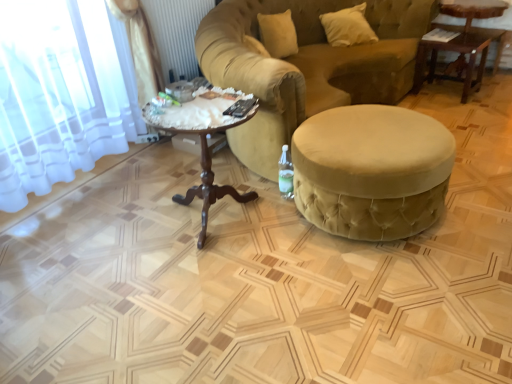
Question: Considering the positions of clear glass bottle at lower right and velvet yellow studio couch at center in the image, is clear glass bottle at lower right bigger or smaller than velvet yellow studio couch at center?

Choices:
 (A) small
 (B) big

Answer: (A)

Question: From a real-world perspective, is clear glass bottle at lower right above or below velvet yellow studio couch at center?

Choices:
 (A) below
 (B) above

Answer: (A)

Question: Considering the real-world distances, which object is farthest from the velvet yellow studio couch at center?

Choices:
 (A) wooden table at upper right, placed as the second table when sorted from left to right
 (B) clear glass bottle at lower right
 (C) velvet beige ottoman at center, which is the first table in left-to-right order
 (D) mahogany wood coffee table at center
 (E) white soft pillow at upper right

Answer: (B)

Question: Which of these objects is positioned farthest from the velvet yellow studio couch at center?

Choices:
 (A) clear glass bottle at lower right
 (B) velvet beige ottoman at center, which appears as the 1th table when ordered from the bottom
 (C) white soft pillow at upper right
 (D) mahogany wood coffee table at center
 (E) wooden table at upper right, placed as the second table when sorted from front to back

Answer: (A)